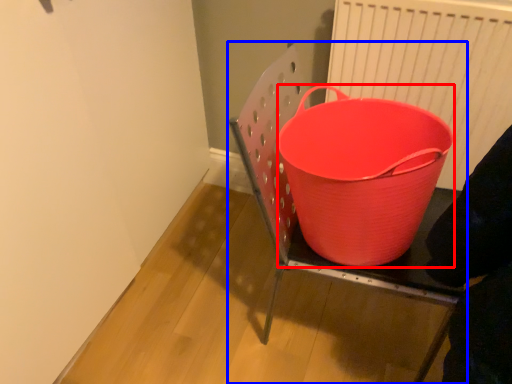
Question: Which point is further to the camera, basket (highlighted by a red box) or furniture (highlighted by a blue box)?

Choices:
 (A) basket
 (B) furniture

Answer: (A)